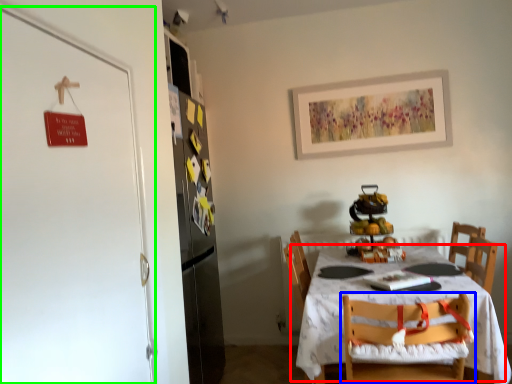
Question: Which object is the closest to the table (highlighted by a red box)? Choose among these: chair (highlighted by a blue box) or door (highlighted by a green box).

Choices:
 (A) chair
 (B) door

Answer: (A)